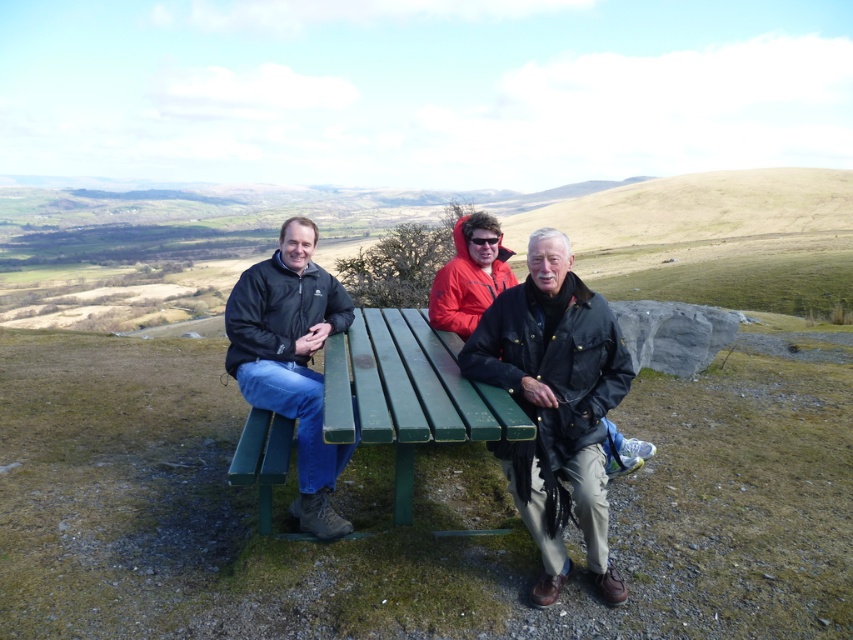
Based on the scene description, what is the object located at the coordinates point (x=408, y=392)?

The object located at point (x=408, y=392) is the green painted wood table at center.

You are standing in front of the picnic area and want to sit next to the person wearing the matte black jacket at left. Which direction should you move relative to the green painted wood bench at center?

The green painted wood bench at center is to the right of the matte black jacket at left. To sit next to the matte black jacket at left, you should move to the left side of the green painted wood bench at center.

You are standing in front of a green painted wood table at center. You need to place a 2.5 meter long board on the table. Is the table long enough to hold the board?

The distance between you and the green painted wood table at center is 2.39 meters, but this measurement refers to the distance from the viewer to the table, not the table length. The table length is not provided, so it is impossible to determine if it can hold the board.